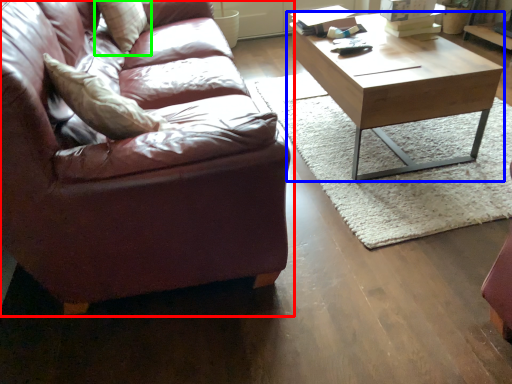
Question: Considering the real-world distances, which object is farthest from studio couch (highlighted by a red box)? coffee table (highlighted by a blue box) or pillow (highlighted by a green box)?

Choices:
 (A) coffee table
 (B) pillow

Answer: (A)